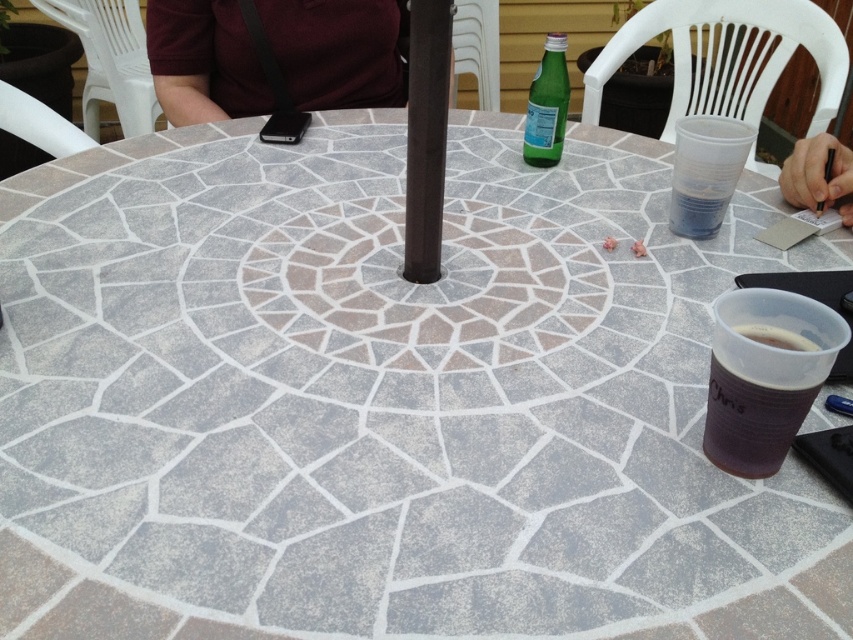
Image resolution: width=853 pixels, height=640 pixels. What do you see at coordinates (426, 136) in the screenshot?
I see `black matte pole at center` at bounding box center [426, 136].

Can you confirm if black matte pole at center is shorter than green glass bottle at upper center?

No, black matte pole at center is not shorter than green glass bottle at upper center.

Is point (426, 224) farther from camera compared to point (556, 42)?

That is False.

Find the location of `black matte pole at center`. black matte pole at center is located at coordinates (426, 136).

Is black matte pole at center closer to camera compared to black paper cup at lower right?

That is False.

Which is behind, point (439, 122) or point (770, 424)?

Positioned behind is point (439, 122).

The height and width of the screenshot is (640, 853). In order to click on black matte pole at center in this screenshot , I will do `click(426, 136)`.

Can you confirm if black paper cup at lower right is taller than black paper at upper right?

Incorrect, black paper cup at lower right's height is not larger of black paper at upper right's.

Which is behind, point (720, 461) or point (850, 195)?

The point (850, 195) is behind.

Who is more forward, (770, 394) or (807, 179)?

Point (770, 394) is more forward.

Where is `black paper cup at lower right`? Image resolution: width=853 pixels, height=640 pixels. black paper cup at lower right is located at coordinates (750, 422).